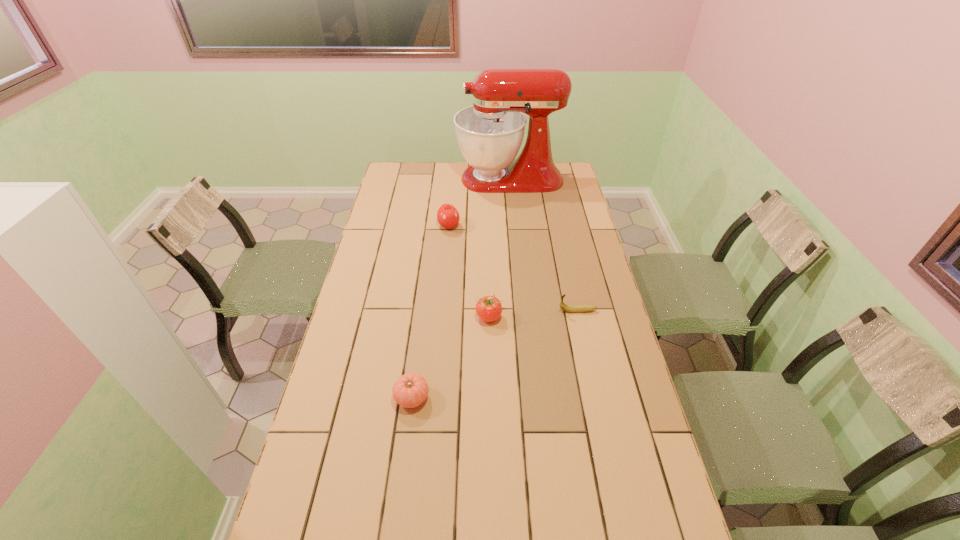
This screenshot has width=960, height=540. What are the coordinates of `free space located at the attachment hub of the farthest object` in the screenshot? It's located at (393, 179).

You are a GUI agent. You are given a task and a screenshot of the screen. Output one action in this format:
    pyautogui.click(x=<x>, y=<y>)
    Task: Click on the blank space located on the front of the fourth nearest object
    
    Given the screenshot: What is the action you would take?
    pyautogui.click(x=446, y=259)

Find the location of a particular element. vacant point located on the right of the farther tomato is located at coordinates (530, 317).

I want to click on blank space located at the stem of the banana, so click(x=541, y=311).

I want to click on vacant area located at the stem of the banana, so click(533, 311).

The height and width of the screenshot is (540, 960). In order to click on free space located at the stem of the banana in this screenshot , I will do `click(492, 311)`.

At what (x,y) coordinates should I click in order to perform the action: click on free point located 0.110m on the front of the left tomato. Please return your answer as a coordinate pair (x, y). Looking at the image, I should click on (405, 451).

Locate an element on the screen. This screenshot has height=540, width=960. object located in the far edge section of the desktop is located at coordinates (490, 133).

You are a GUI agent. You are given a task and a screenshot of the screen. Output one action in this format:
    pyautogui.click(x=<x>, y=<y>)
    Task: Click on the mixer at the right edge
    The width and height of the screenshot is (960, 540).
    Given the screenshot: What is the action you would take?
    pyautogui.click(x=490, y=133)

Find the location of a particular element. The image size is (960, 540). banana present at the right edge is located at coordinates (568, 308).